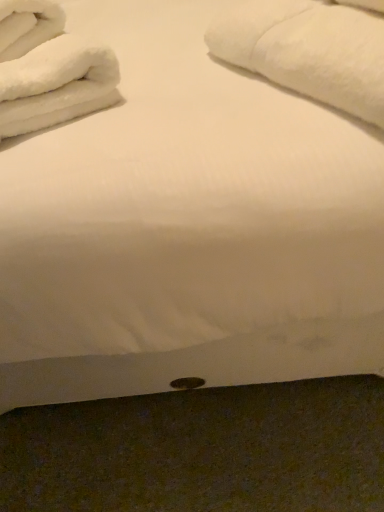
Question: From a real-world perspective, relative to white fluffy towels at upper left, positioned as the second bath towel in right-to-left order, is white soft towel at upper right, which appears as the second bath towel when viewed from the left, vertically above or below?

Choices:
 (A) below
 (B) above

Answer: (B)

Question: Choose the correct answer: Is white soft towel at upper right, the first bath towel in the right-to-left sequence, inside white fluffy towels at upper left, placed as the 1th bath towel when sorted from left to right, or outside it?

Choices:
 (A) inside
 (B) outside

Answer: (B)

Question: In terms of size, does white soft towel at upper right, the first bath towel in the right-to-left sequence, appear bigger or smaller than white fluffy towels at upper left, positioned as the second bath towel in right-to-left order?

Choices:
 (A) small
 (B) big

Answer: (B)

Question: From the image's perspective, is white fluffy towels at upper left, positioned as the second bath towel in right-to-left order, located above or below white soft towel at upper right, which appears as the second bath towel when viewed from the left?

Choices:
 (A) below
 (B) above

Answer: (A)

Question: Based on their sizes in the image, would you say white fluffy towels at upper left, positioned as the second bath towel in right-to-left order, is bigger or smaller than white soft towel at upper right, the first bath towel in the right-to-left sequence?

Choices:
 (A) big
 (B) small

Answer: (B)

Question: Looking at their shapes, would you say white fluffy towels at upper left, placed as the 1th bath towel when sorted from left to right, is wider or thinner than white soft towel at upper right, the first bath towel in the right-to-left sequence?

Choices:
 (A) wide
 (B) thin

Answer: (A)

Question: In the image, is white fluffy towels at upper left, placed as the 1th bath towel when sorted from left to right, on the left side or the right side of white soft towel at upper right, which appears as the second bath towel when viewed from the left?

Choices:
 (A) left
 (B) right

Answer: (A)